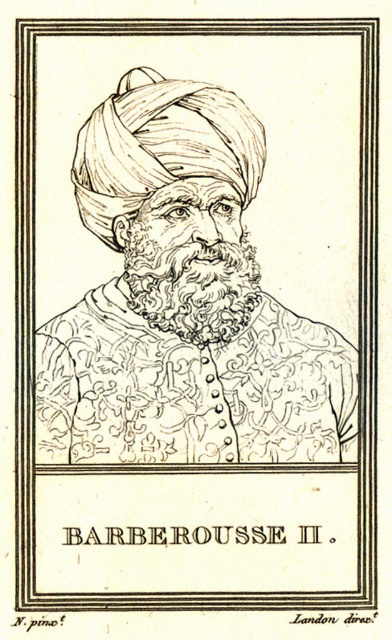
What are the coordinates of the etched gold robe at center in the image?

The coordinates of the etched gold robe at center are at point (190, 388).

You are a photographer standing in front of a framed black ink drawing of man at center. The frame has a double border. You want to take a closeup photo of the man without the frame. What is the minimum distance you should maintain from the frame to ensure the entire man is in focus?

The black ink drawing of man at center is 1.80 meters away from the camera. To capture the entire man without the frame in your closeup photo, you should maintain a distance of at least 1.80 meters from the frame.